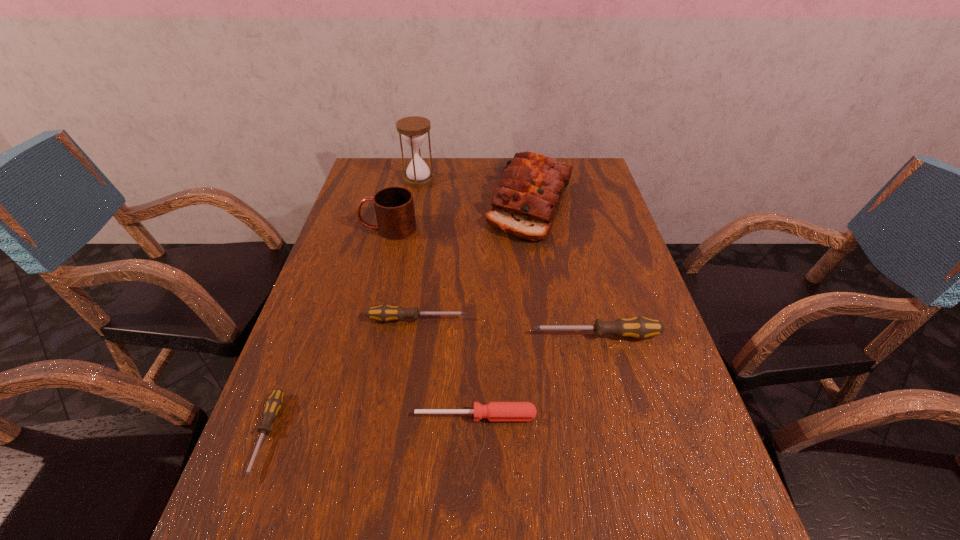
What are the coordinates of `vacant space at the right edge` in the screenshot? It's located at (651, 367).

Identify the location of free space at the far left corner. 365,173.

The width and height of the screenshot is (960, 540). In order to click on vacant position at the far right corner of the desktop in this screenshot , I will do `click(589, 167)`.

Image resolution: width=960 pixels, height=540 pixels. I want to click on free space between the second farthest screwdriver and the fifth tallest object, so click(x=507, y=327).

Where is `vacant space in between the mug and the fifth farthest object`? This screenshot has width=960, height=540. vacant space in between the mug and the fifth farthest object is located at coordinates (492, 282).

I want to click on free space between the fourth shortest object and the mug, so click(492, 282).

Identify the location of vacant point located between the nearest gray screwdriver and the third nearest object. The width and height of the screenshot is (960, 540). (431, 385).

Select which object appears as the third closest to the second farthest screwdriver. Please provide its 2D coordinates. Your answer should be formatted as a tuple, i.e. [(x, y)], where the tuple contains the x and y coordinates of a point satisfying the conditions above.

[(525, 203)]

Identify which object is the second nearest to the fourth nearest object. Please provide its 2D coordinates. Your answer should be formatted as a tuple, i.e. [(x, y)], where the tuple contains the x and y coordinates of a point satisfying the conditions above.

[(494, 411)]

Select which screwdriver appears as the second closest to the rightmost screwdriver. Please provide its 2D coordinates. Your answer should be formatted as a tuple, i.e. [(x, y)], where the tuple contains the x and y coordinates of a point satisfying the conditions above.

[(494, 411)]